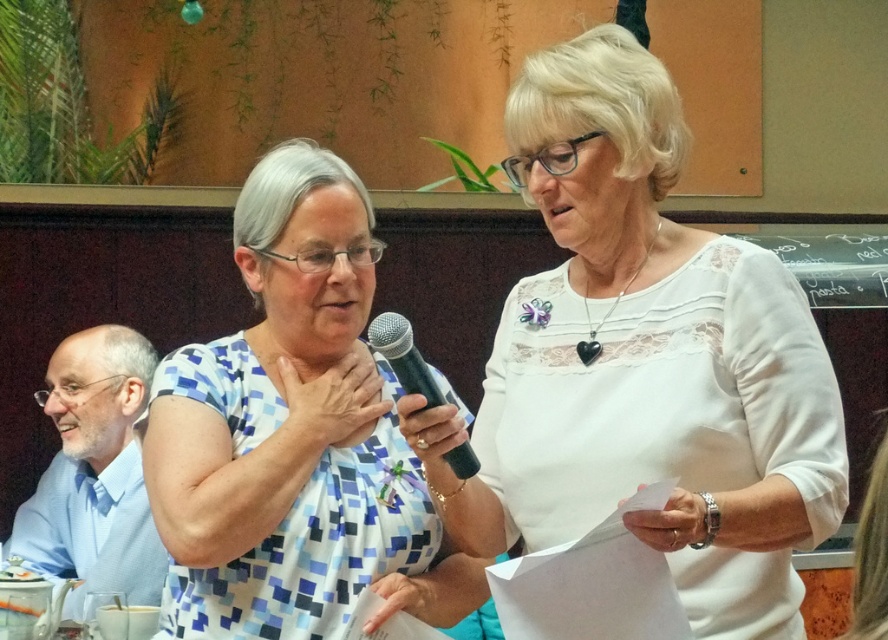
Can you confirm if white lace blouse at upper center is smaller than blue checkered dress at center?

No, white lace blouse at upper center is not smaller than blue checkered dress at center.

Locate an element on the screen. white lace blouse at upper center is located at coordinates (643, 362).

Between point (427, 419) and point (358, 256), which one is positioned behind?

Positioned behind is point (358, 256).

Find the location of a particular element. The image size is (888, 640). white lace blouse at upper center is located at coordinates (643, 362).

Identify the location of blue checkered dress at center. The height and width of the screenshot is (640, 888). (294, 435).

Is blue checkered dress at center bigger than black plastic microphone at center?

Correct, blue checkered dress at center is larger in size than black plastic microphone at center.

You are a GUI agent. You are given a task and a screenshot of the screen. Output one action in this format:
    pyautogui.click(x=<x>, y=<y>)
    Task: Click on the blue checkered dress at center
    Image resolution: width=888 pixels, height=640 pixels.
    Given the screenshot: What is the action you would take?
    pyautogui.click(x=294, y=435)

Which is more to the right, blue checkered dress at center or blue shirt at left?

blue checkered dress at center is more to the right.

Which of these two, blue checkered dress at center or blue shirt at left, stands taller?

blue checkered dress at center is taller.

Which is behind, point (316, 294) or point (53, 481)?

The point (53, 481) is behind.

You are a GUI agent. You are given a task and a screenshot of the screen. Output one action in this format:
    pyautogui.click(x=<x>, y=<y>)
    Task: Click on the blue checkered dress at center
    
    Given the screenshot: What is the action you would take?
    pyautogui.click(x=294, y=435)